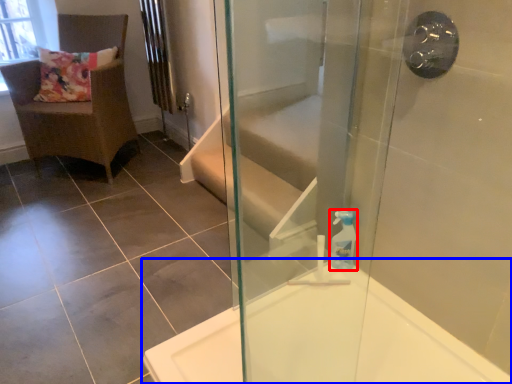
Question: Among these objects, which one is farthest to the camera, soap dispenser (highlighted by a red box) or bathtub (highlighted by a blue box)?

Choices:
 (A) soap dispenser
 (B) bathtub

Answer: (A)